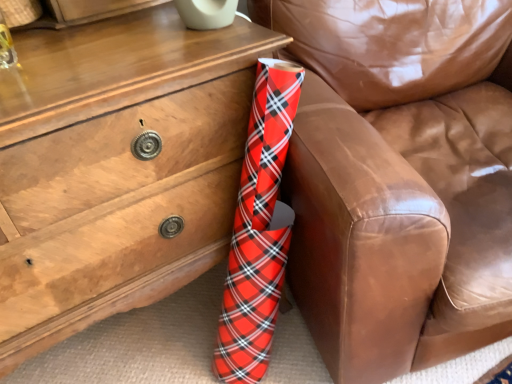
Question: Is matte wood chest of drawers at lower left inside the boundaries of red plaid wrapping paper at lower left, or outside?

Choices:
 (A) outside
 (B) inside

Answer: (A)

Question: Looking at their shapes, would you say matte wood chest of drawers at lower left is wider or thinner than red plaid wrapping paper at lower left?

Choices:
 (A) wide
 (B) thin

Answer: (B)

Question: Considering the positions of matte wood chest of drawers at lower left and red plaid wrapping paper at lower left in the image, is matte wood chest of drawers at lower left bigger or smaller than red plaid wrapping paper at lower left?

Choices:
 (A) big
 (B) small

Answer: (B)

Question: From the image's perspective, is red plaid wrapping paper at lower left located above or below matte wood chest of drawers at lower left?

Choices:
 (A) above
 (B) below

Answer: (A)

Question: Is red plaid wrapping paper at lower left situated inside matte wood chest of drawers at lower left or outside?

Choices:
 (A) outside
 (B) inside

Answer: (A)

Question: In the image, is red plaid wrapping paper at lower left positioned in front of or behind matte wood chest of drawers at lower left?

Choices:
 (A) behind
 (B) front

Answer: (B)

Question: Is point [x=333, y=367] positioned closer to the camera than point [x=160, y=210]?

Choices:
 (A) closer
 (B) farther

Answer: (B)